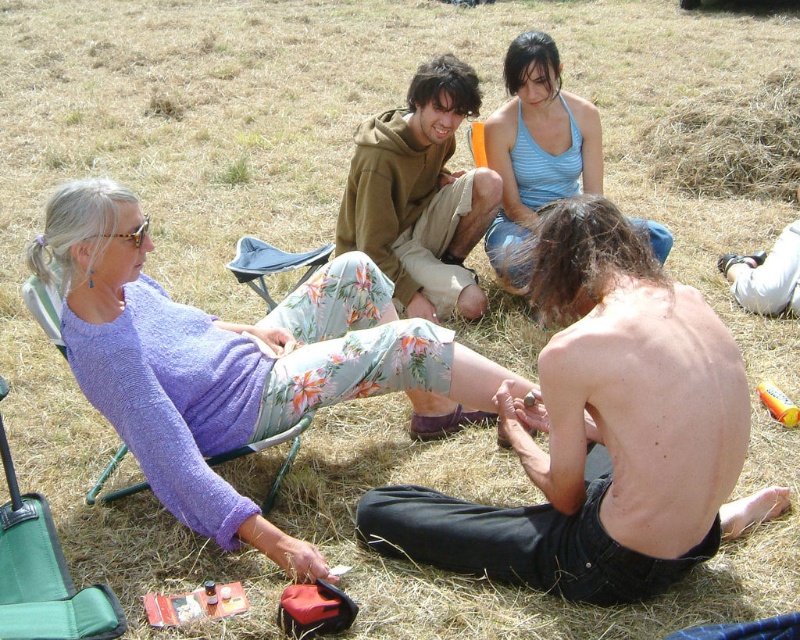
Image resolution: width=800 pixels, height=640 pixels. Describe the element at coordinates (730, 140) in the screenshot. I see `brown dry grass at upper right` at that location.

Does brown dry grass at upper right have a greater height compared to gray fabric chair at upper center?

Yes.

Who is more forward, (684, 189) or (245, 237)?

Point (245, 237) is in front.

At what (x,y) coordinates should I click in order to perform the action: click on brown dry grass at upper right. Please return your answer as a coordinate pair (x, y). Looking at the image, I should click on coord(730,140).

From the picture: Is purple knit sweater at upper left in front of brown dry grass at upper right?

Yes, it is in front of brown dry grass at upper right.

Who is more distant from viewer, [186,349] or [745,116]?

Positioned behind is point [745,116].

Is point (389, 304) farther from viewer compared to point (772, 122)?

No, it is not.

You are a GUI agent. You are given a task and a screenshot of the screen. Output one action in this format:
    pyautogui.click(x=<x>, y=<y>)
    Task: Click on the purple knit sweater at upper left
    This screenshot has height=640, width=800.
    Given the screenshot: What is the action you would take?
    pyautogui.click(x=237, y=362)

In the scene shown: Who is taller, shiny black skin at lower right or brown cotton hoodie at center?

Standing taller between the two is brown cotton hoodie at center.

Which is more to the right, shiny black skin at lower right or brown cotton hoodie at center?

shiny black skin at lower right is more to the right.

Is point (529, 515) positioned after point (410, 248)?

No.

Image resolution: width=800 pixels, height=640 pixels. Find the location of `shiny black skin at lower right`. shiny black skin at lower right is located at coordinates (601, 433).